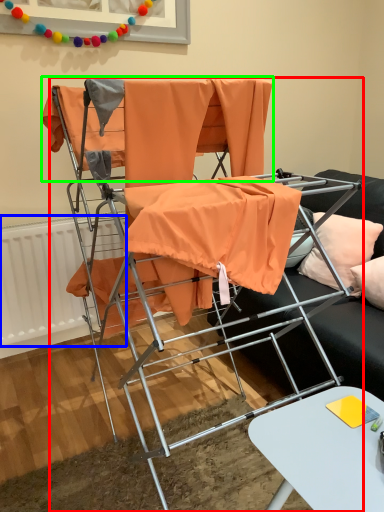
Question: Which object is the closest to the chair (highlighted by a red box)? Choose among these: radiator (highlighted by a blue box) or fabric (highlighted by a green box).

Choices:
 (A) radiator
 (B) fabric

Answer: (B)